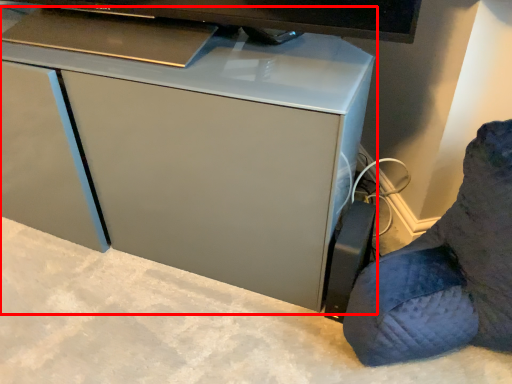
Question: Considering the relative positions of computer desk (annotated by the red box) and furniture in the image provided, where is computer desk (annotated by the red box) located with respect to the staircase?

Choices:
 (A) left
 (B) right

Answer: (A)